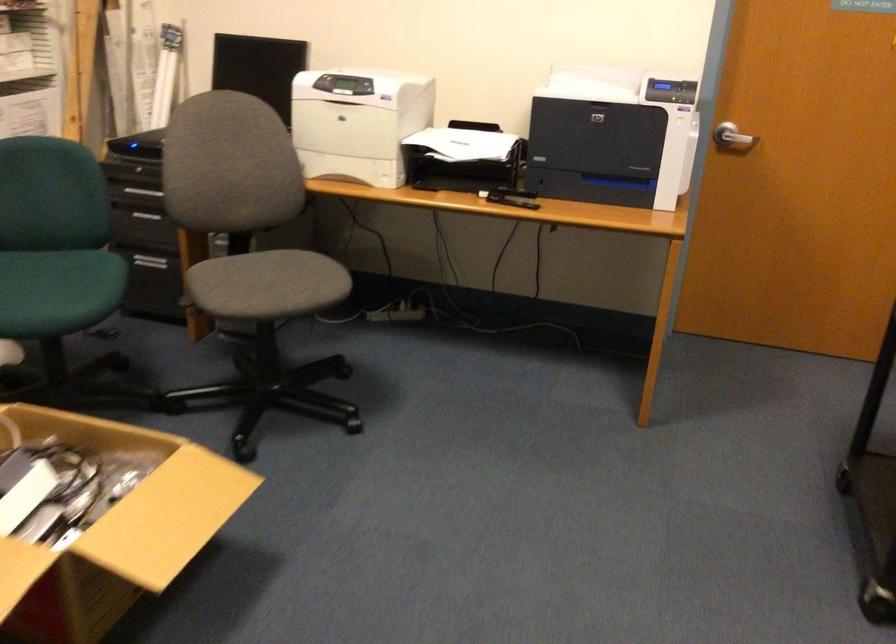
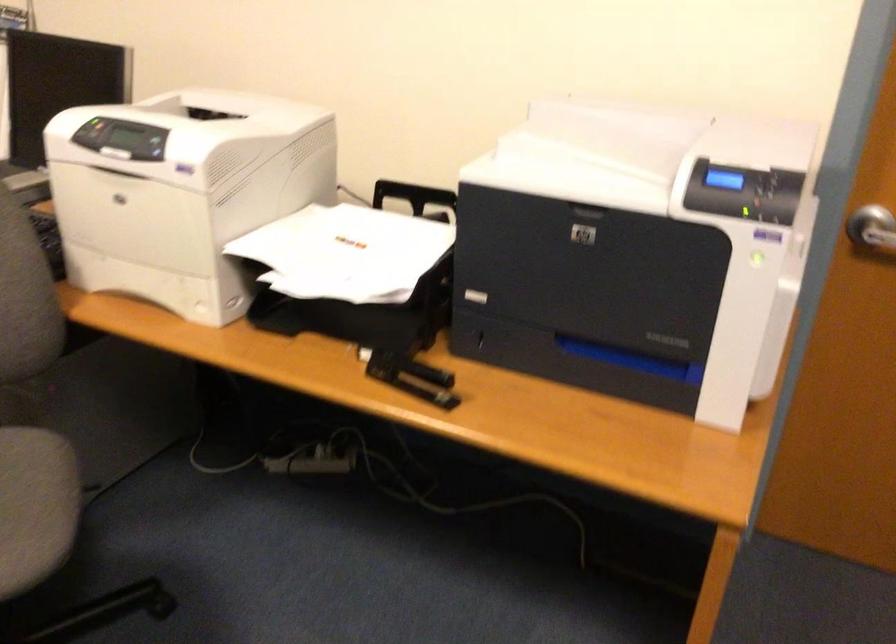
Locate, in the second image, the point that corresponds to (323,79) in the first image.

(91, 131)